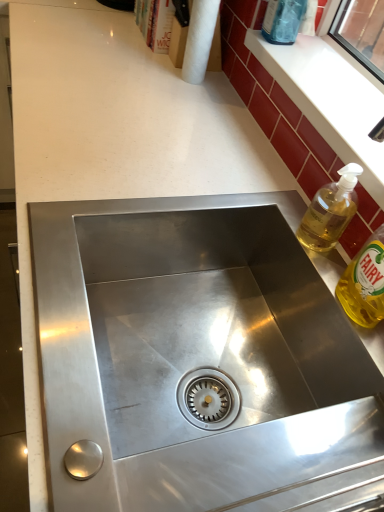
The width and height of the screenshot is (384, 512). Find the location of `space that is in front of transparent glass bottle at upper right, the 3th bottle in the bottom-to-top sequence`. space that is in front of transparent glass bottle at upper right, the 3th bottle in the bottom-to-top sequence is located at coordinates (283, 66).